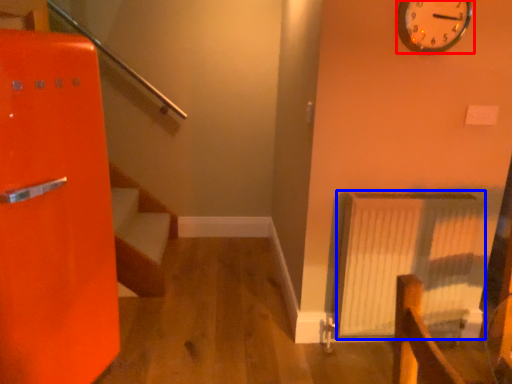
Question: Which object is closer to the camera taking this photo, wall clock (highlighted by a red box) or radiator (highlighted by a blue box)?

Choices:
 (A) wall clock
 (B) radiator

Answer: (A)